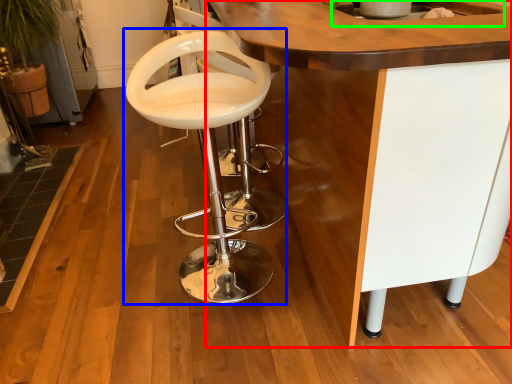
Question: Considering the real-world distances, which object is farthest from table (highlighted by a red box)? chair (highlighted by a blue box) or sink (highlighted by a green box)?

Choices:
 (A) chair
 (B) sink

Answer: (A)